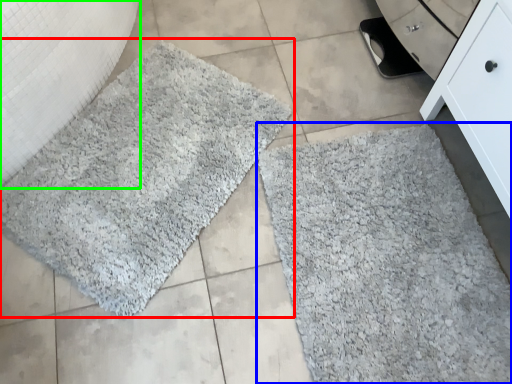
Question: Which object is positioned farthest from bath mat (highlighted by a red box)? Select from bath mat (highlighted by a blue box) and granite (highlighted by a green box).

Choices:
 (A) bath mat
 (B) granite

Answer: (A)